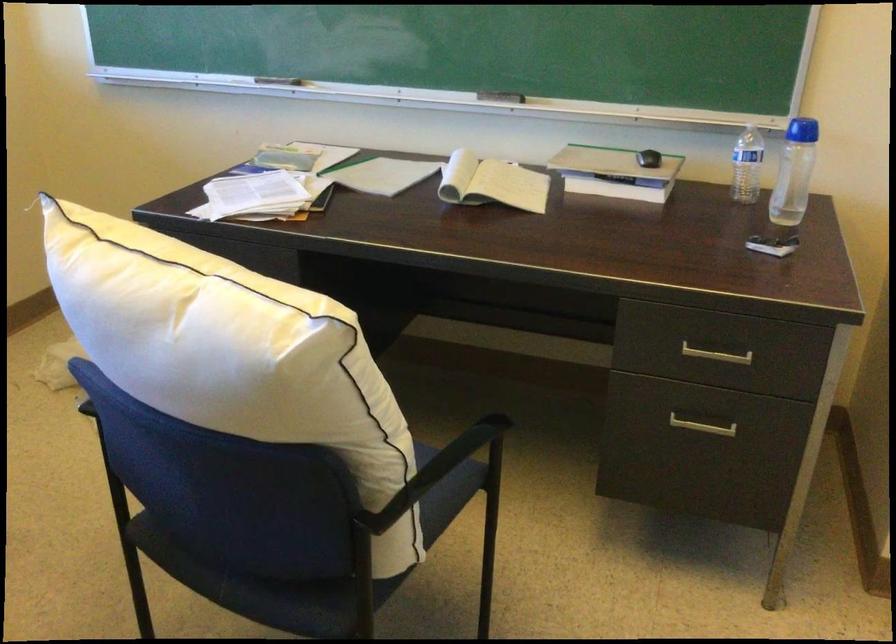
Describe the element at coordinates (231, 353) in the screenshot. This screenshot has width=896, height=644. I see `the white pillow` at that location.